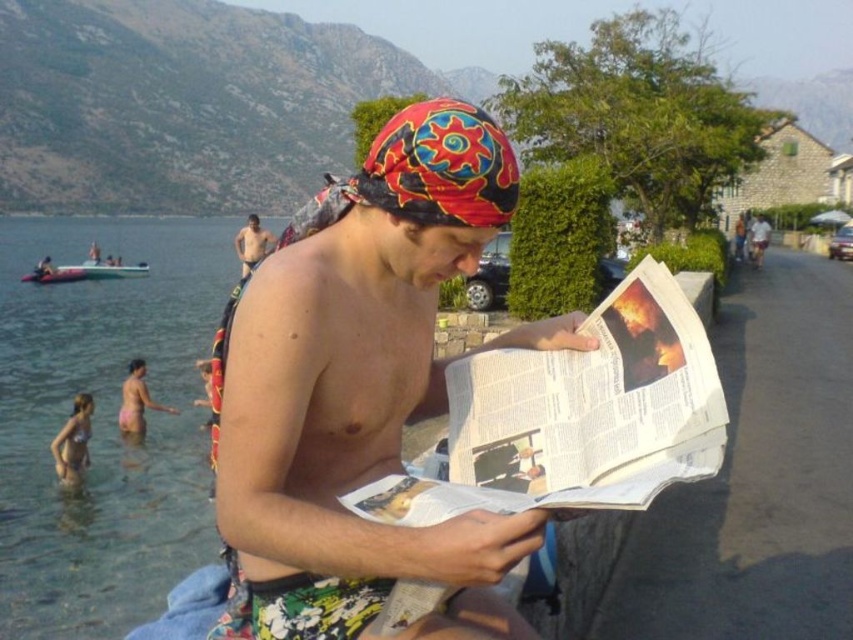
Which of these two, pink fabric bikini at lower left or white cotton shirt at right, stands taller?

white cotton shirt at right

Where is `pink fabric bikini at lower left`? The width and height of the screenshot is (853, 640). pink fabric bikini at lower left is located at coordinates (136, 401).

Between multicolored fabric headscarf at center and pink fabric bikini at lower left, which one appears on the right side from the viewer's perspective?

Positioned to the right is multicolored fabric headscarf at center.

Is multicolored fabric headscarf at center shorter than pink fabric bikini at lower left?

No.

Which is in front, point (450, 108) or point (137, 410)?

Point (450, 108) is more forward.

The image size is (853, 640). In order to click on multicolored fabric headscarf at center in this screenshot , I will do `click(440, 166)`.

Based on the photo, can you confirm if multicolored fabric headscarf at center is taller than matte black skin at center?

No.

This screenshot has height=640, width=853. Describe the element at coordinates (440, 166) in the screenshot. I see `multicolored fabric headscarf at center` at that location.

Is point (496, 211) closer to camera compared to point (263, 252)?

Yes, it is.

At what (x,y) coordinates should I click in order to perform the action: click on multicolored fabric headscarf at center. Please return your answer as a coordinate pair (x, y). The width and height of the screenshot is (853, 640). Looking at the image, I should click on (440, 166).